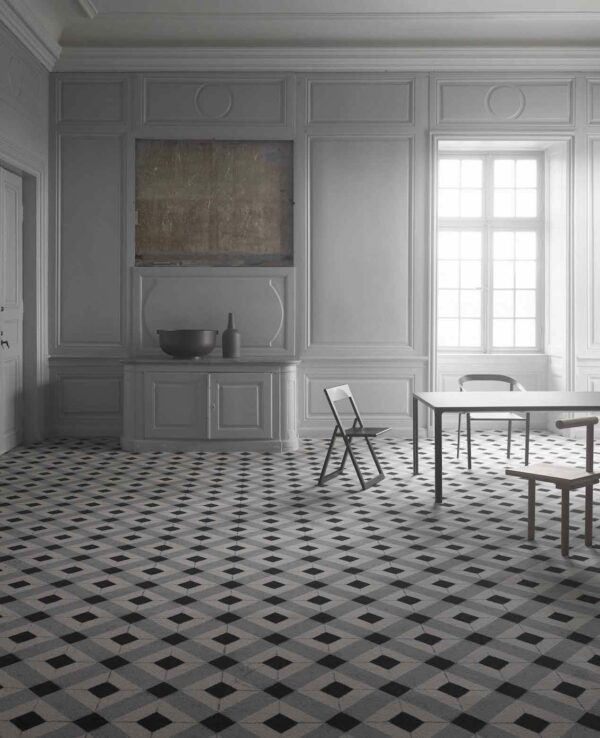
You are a GUI agent. You are given a task and a screenshot of the screen. Output one action in this format:
    pyautogui.click(x=<x>, y=<y>)
    Task: Click on the bottle
    
    Given the screenshot: What is the action you would take?
    (x=232, y=339)